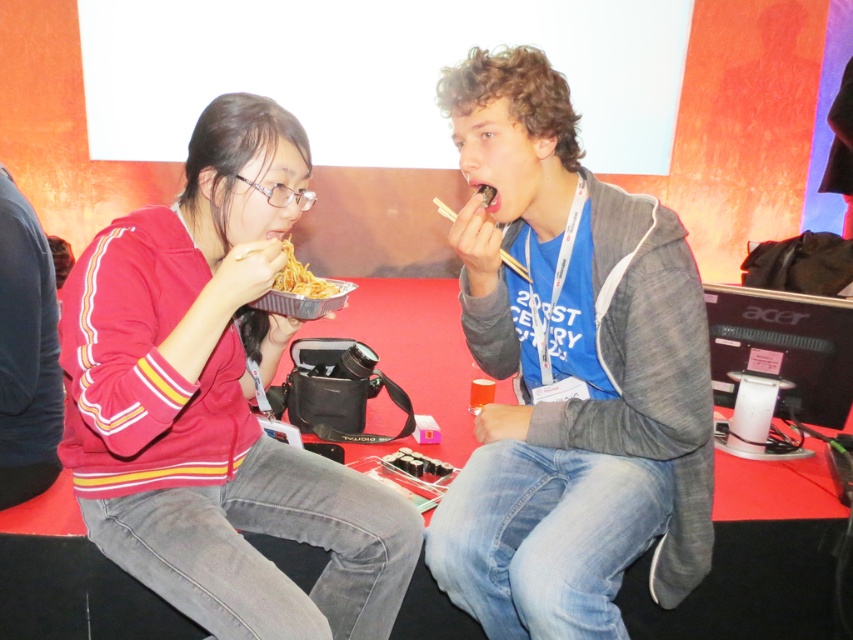
Question: From the image, what is the correct spatial relationship of gray fleece jacket at center in relation to wooden chopsticks at upper center?

Choices:
 (A) right
 (B) left

Answer: (A)

Question: Based on their relative distances, which object is farther from the gray fleece jacket at center?

Choices:
 (A) wooden chopsticks at upper center
 (B) matte red sweater at center

Answer: (B)

Question: Considering the real-world distances, which object is closest to the wooden chopsticks at upper center?

Choices:
 (A) gray fleece jacket at center
 (B) matte red sweater at center
 (C) shiny metallic noodles at center

Answer: (C)

Question: Does matte red sweater at center lie behind shiny metallic noodles at center?

Choices:
 (A) no
 (B) yes

Answer: (A)

Question: Is shiny metallic noodles at center closer to the viewer compared to wooden chopsticks at upper center?

Choices:
 (A) no
 (B) yes

Answer: (B)

Question: Considering the real-world distances, which object is farthest from the shiny metallic noodles at center?

Choices:
 (A) matte red sweater at center
 (B) gray fleece jacket at center

Answer: (B)